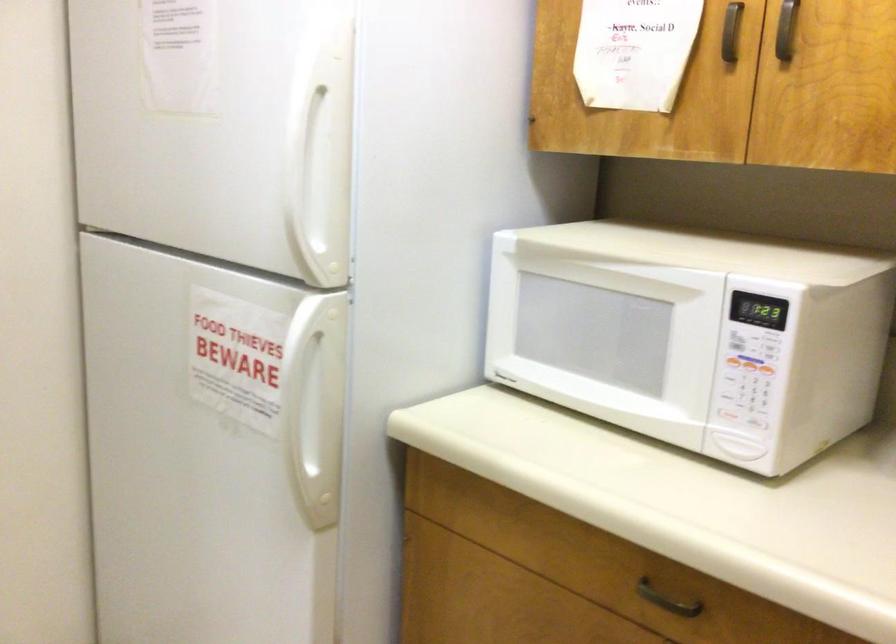
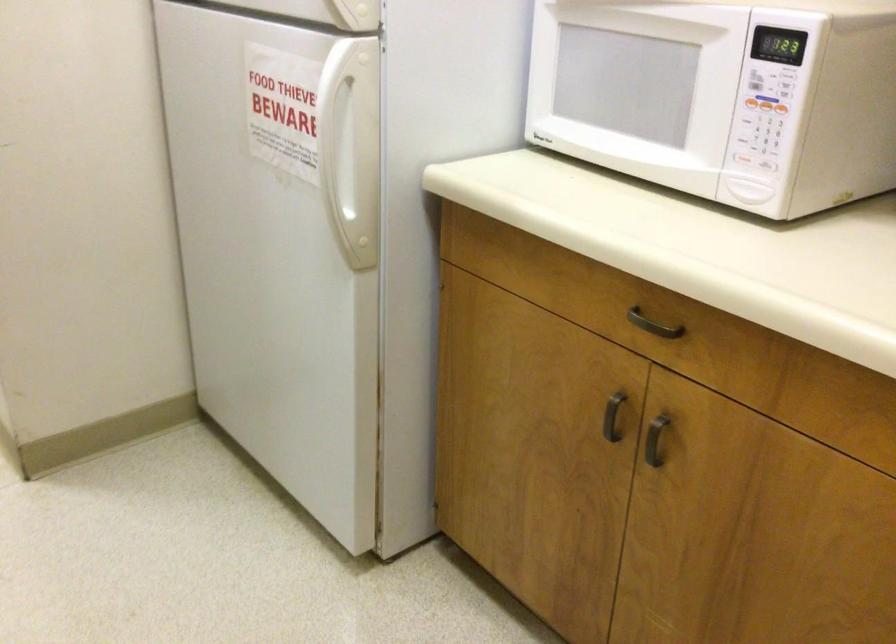
Find the pixel in the second image that matches point (756, 422) in the first image.

(764, 164)